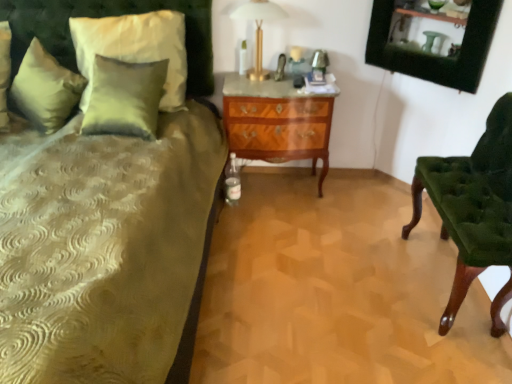
Image resolution: width=512 pixels, height=384 pixels. Identify the location of free space to the back side of velvet green chair at right. (378, 218).